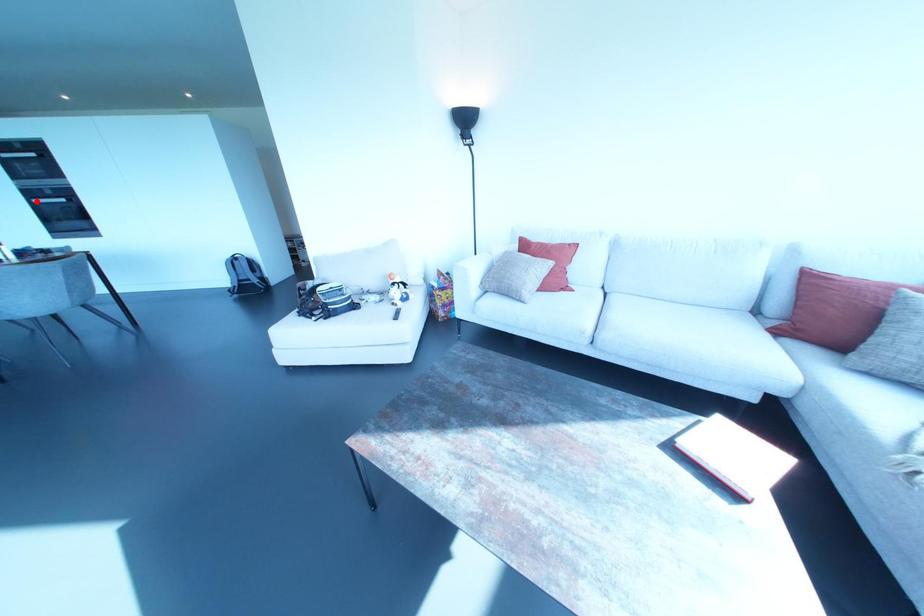
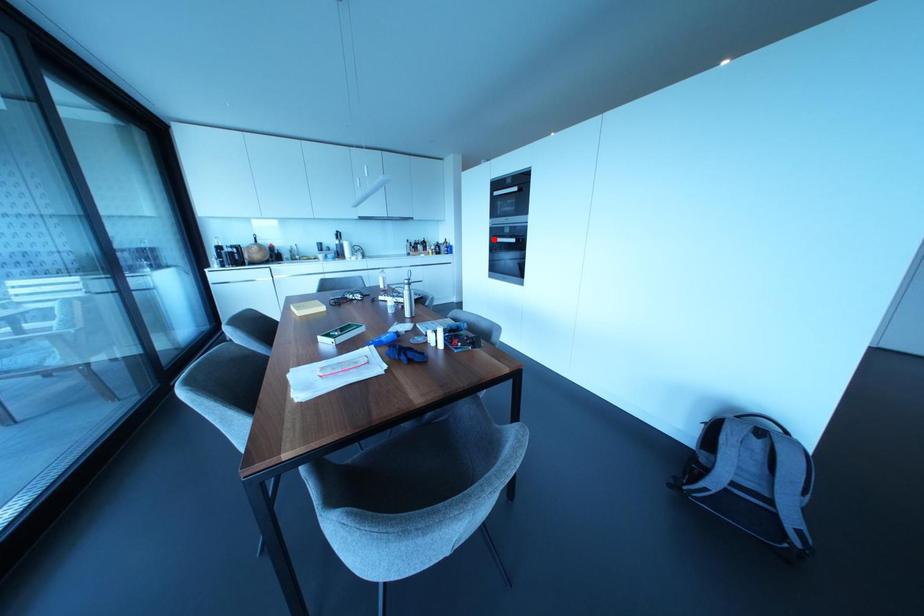
I am providing you with two images of the same scene from different viewpoints. A red point is marked on the first image and another point is marked on the second image. Is the marked point in image1 the same physical position as the marked point in image2?

Yes